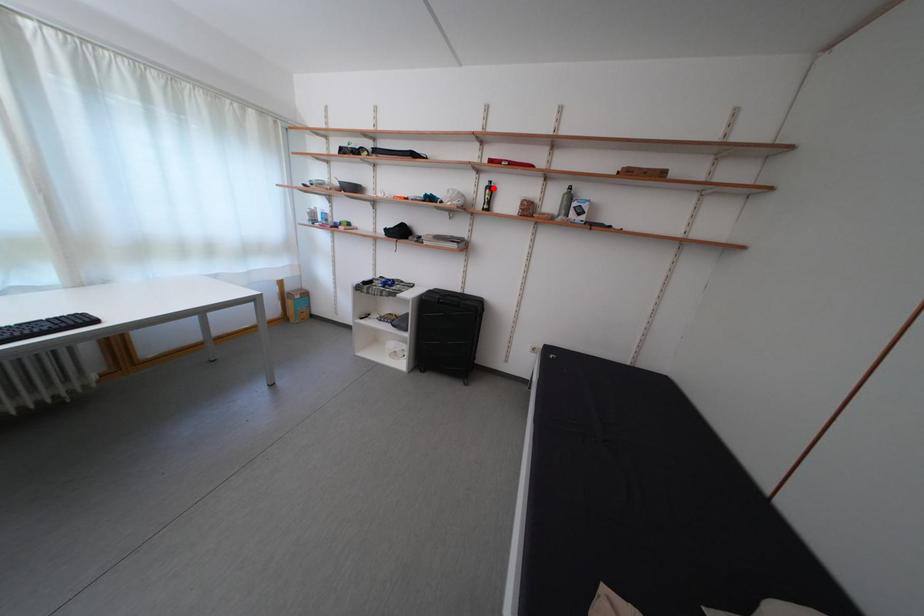
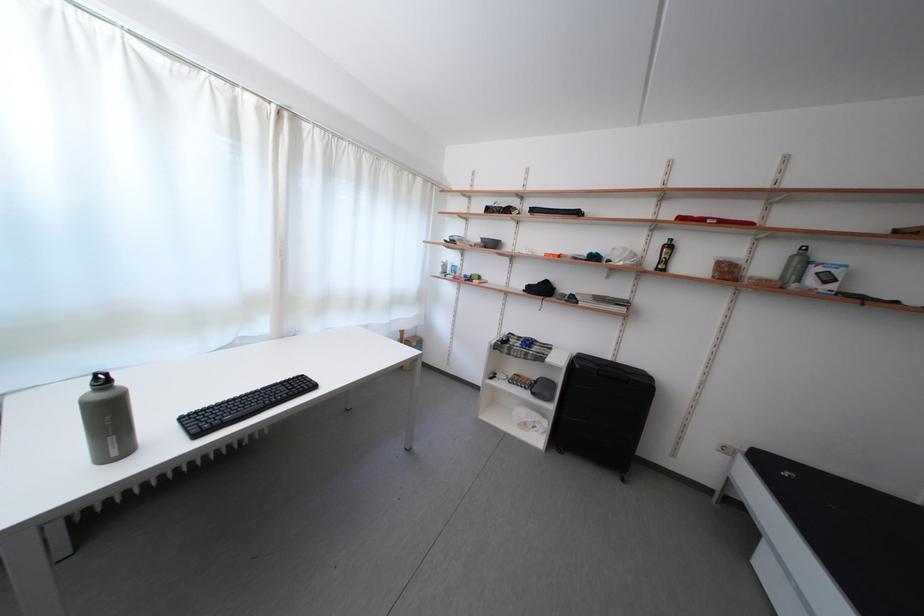
Question: I am providing you with two images of the same scene from different viewpoints. A red point is marked on the first image. At the location where the point appears in image 1, is it still visible in image 2?

Choices:
 (A) Yes
 (B) No

Answer: (A)